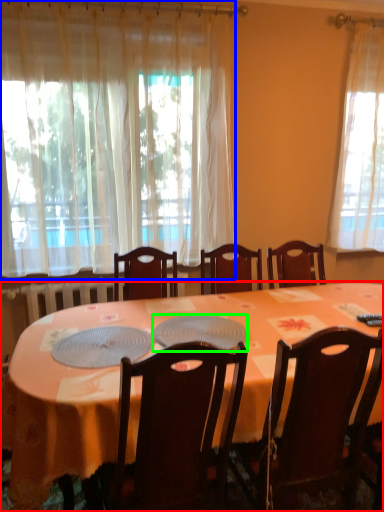
Question: Considering the real-world distances, which object is closest to desk (highlighted by a red box)? curtain (highlighted by a blue box) or platter (highlighted by a green box).

Choices:
 (A) curtain
 (B) platter

Answer: (B)